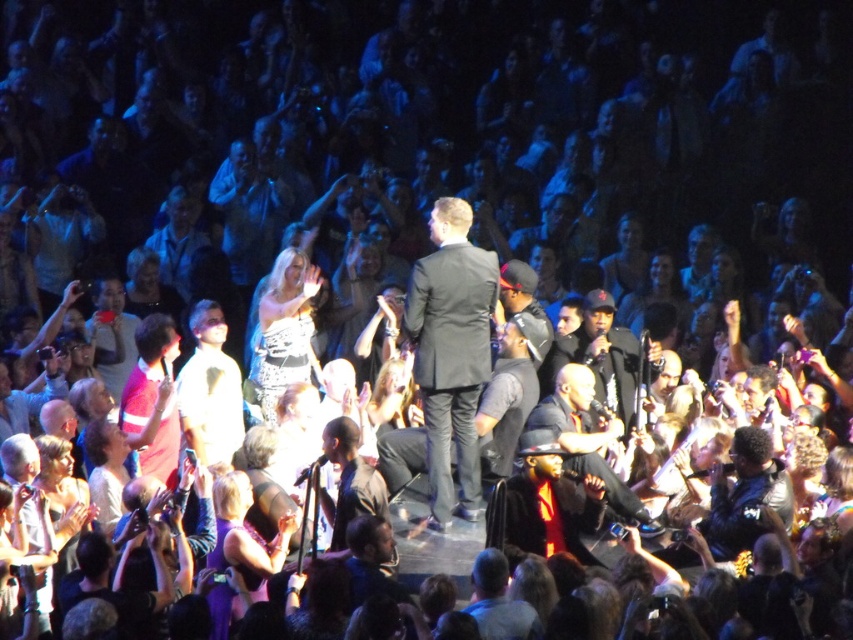
Which is in front, point (495, 285) or point (624, 500)?

Point (495, 285)

Where is `matte black suit at center`? This screenshot has height=640, width=853. matte black suit at center is located at coordinates (451, 353).

In order to click on matte black suit at center in this screenshot , I will do `click(451, 353)`.